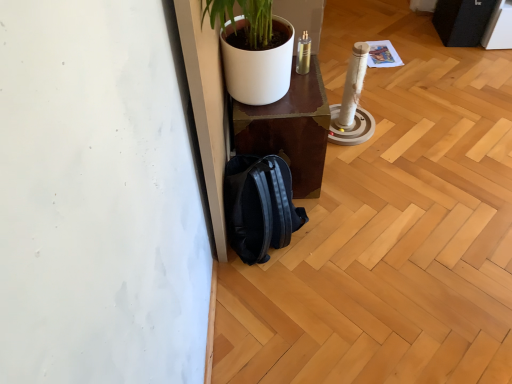
This screenshot has width=512, height=384. Find the location of `shiny brown table at center`. shiny brown table at center is located at coordinates (288, 129).

What is the approximate width of shiny brown table at center?

The width of shiny brown table at center is 15.40 inches.

This screenshot has height=384, width=512. Describe the element at coordinates (288, 129) in the screenshot. I see `shiny brown table at center` at that location.

I want to click on black matte backpack at lower center, so click(259, 206).

Describe the element at coordinates (259, 206) in the screenshot. I see `black matte backpack at lower center` at that location.

What are the coordinates of `shiny brown table at center` in the screenshot? It's located at (288, 129).

Visually, is shiny brown table at center positioned to the left or to the right of black matte backpack at lower center?

Based on their positions, shiny brown table at center is located to the right of black matte backpack at lower center.

Based on the photo, which object is closer to the camera, shiny brown table at center or black matte backpack at lower center?

Positioned in front is black matte backpack at lower center.

Does point (298, 107) come closer to viewer compared to point (287, 177)?

Yes, it is.

From the image's perspective, is shiny brown table at center above or below black matte backpack at lower center?

Clearly, from the image's perspective, shiny brown table at center is above black matte backpack at lower center.

From a real-world perspective, is shiny brown table at center positioned under black matte backpack at lower center based on gravity?

No, from a real-world perspective, shiny brown table at center is not below black matte backpack at lower center.

Consider the image. Between shiny brown table at center and black matte backpack at lower center, which one has smaller width?

With smaller width is black matte backpack at lower center.

In terms of height, does shiny brown table at center look taller or shorter compared to black matte backpack at lower center?

Clearly, shiny brown table at center is taller compared to black matte backpack at lower center.

Is shiny brown table at center bigger than black matte backpack at lower center?

Indeed, shiny brown table at center has a larger size compared to black matte backpack at lower center.

Is shiny brown table at center situated inside black matte backpack at lower center or outside?

shiny brown table at center lies outside black matte backpack at lower center.

Are shiny brown table at center and black matte backpack at lower center far apart?

No, shiny brown table at center is not far from black matte backpack at lower center.

Is shiny brown table at center facing away from black matte backpack at lower center?

No, shiny brown table at center's orientation is not away from black matte backpack at lower center.

How far apart are shiny brown table at center and black matte backpack at lower center?

shiny brown table at center and black matte backpack at lower center are 18.80 centimeters apart from each other.

The height and width of the screenshot is (384, 512). What are the coordinates of `furniture on the right of black matte backpack at lower center` in the screenshot? It's located at (288, 129).

Does black matte backpack at lower center appear on the right side of shiny brown table at center?

In fact, black matte backpack at lower center is to the left of shiny brown table at center.

In the image, is black matte backpack at lower center positioned in front of or behind shiny brown table at center?

Visually, black matte backpack at lower center is located in front of shiny brown table at center.

Considering the positions of points (236, 221) and (318, 128), is point (236, 221) closer to camera compared to point (318, 128)?

Yes, it is in front of point (318, 128).

From the image's perspective, is black matte backpack at lower center above shiny brown table at center?

Incorrect, from the image's perspective, black matte backpack at lower center is lower than shiny brown table at center.

From a real-world perspective, is black matte backpack at lower center positioned above or below shiny brown table at center?

black matte backpack at lower center is situated lower than shiny brown table at center in the real world.

Between black matte backpack at lower center and shiny brown table at center, which one has larger width?

Wider between the two is shiny brown table at center.

Considering the relative sizes of black matte backpack at lower center and shiny brown table at center in the image provided, is black matte backpack at lower center taller than shiny brown table at center?

Incorrect, the height of black matte backpack at lower center is not larger of that of shiny brown table at center.

Does black matte backpack at lower center have a larger size compared to shiny brown table at center?

Incorrect, black matte backpack at lower center is not larger than shiny brown table at center.

In the scene shown: Is black matte backpack at lower center located outside shiny brown table at center?

black matte backpack at lower center is positioned outside shiny brown table at center.

Is black matte backpack at lower center positioned far away from shiny brown table at center?

black matte backpack at lower center is near shiny brown table at center, not far away.

Does black matte backpack at lower center turn towards shiny brown table at center?

No.

How many degrees apart are the facing directions of black matte backpack at lower center and shiny brown table at center?

0.000173 degrees.

This screenshot has height=384, width=512. I want to click on furniture located behind the black matte backpack at lower center, so click(x=288, y=129).

This screenshot has height=384, width=512. Identify the location of backpack on the left of shiny brown table at center. (259, 206).

Locate an element on the screen. The image size is (512, 384). backpack below the shiny brown table at center (from a real-world perspective) is located at coordinates (259, 206).